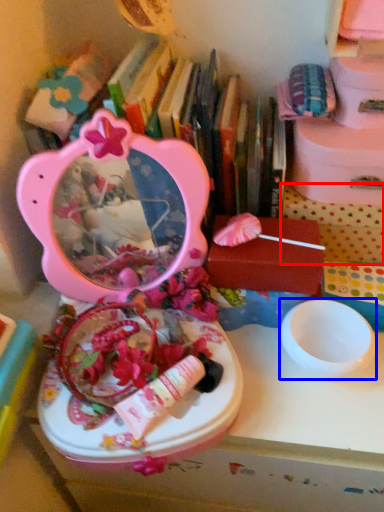
Question: Which object is further to the camera taking this photo, storage box (highlighted by a red box) or bowl (highlighted by a blue box)?

Choices:
 (A) storage box
 (B) bowl

Answer: (A)